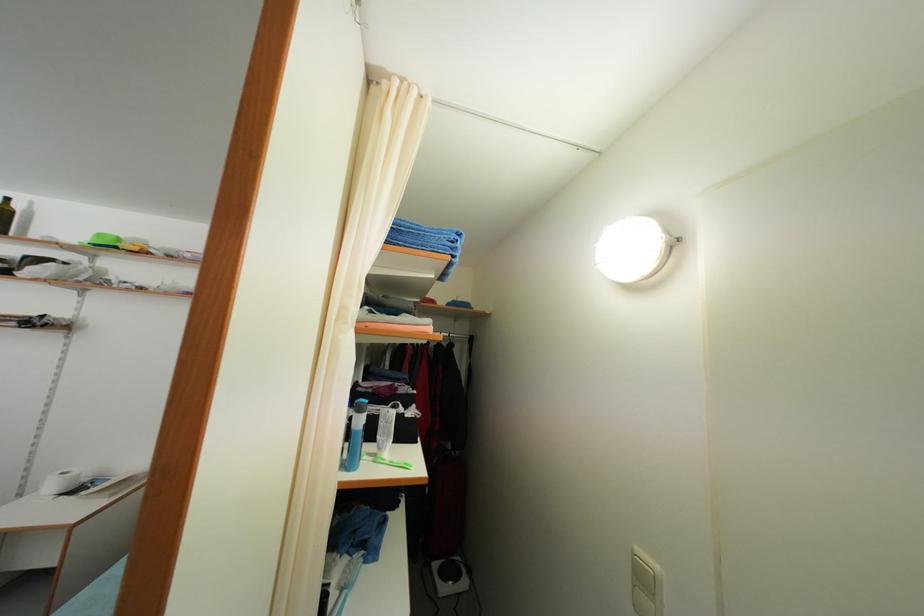
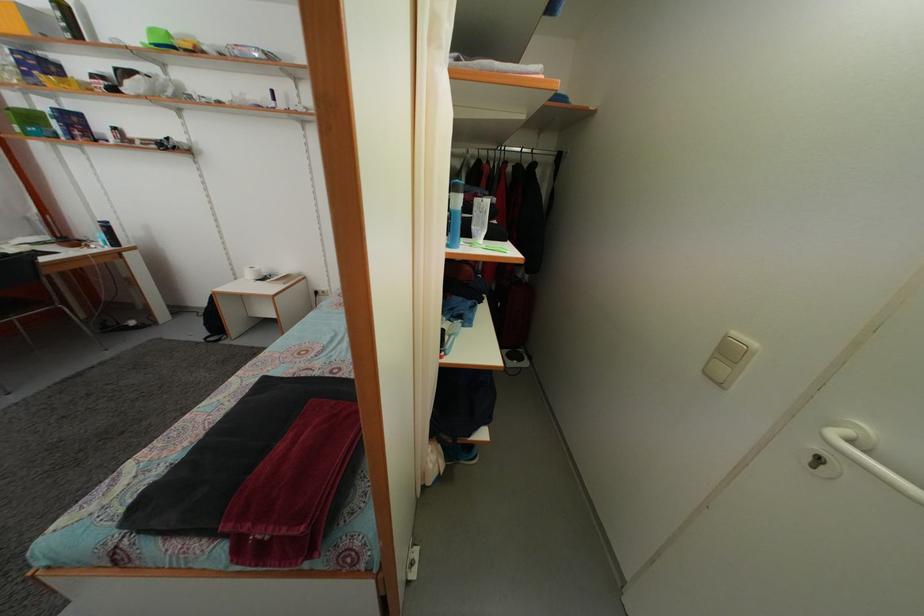
First-person continuous shooting, in which direction is the camera rotating?

The rotation direction of the camera is left-down.